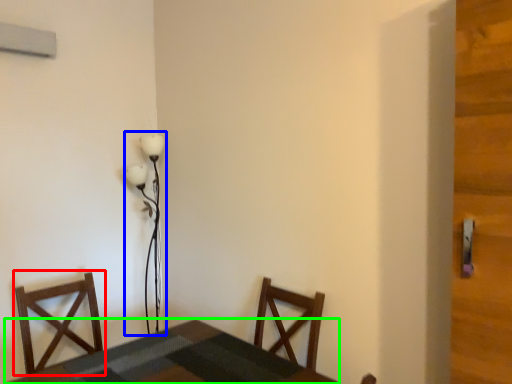
Question: Which is farther away from chair (highlighted by a red box)? lamp (highlighted by a blue box) or table (highlighted by a green box)?

Choices:
 (A) lamp
 (B) table

Answer: (A)